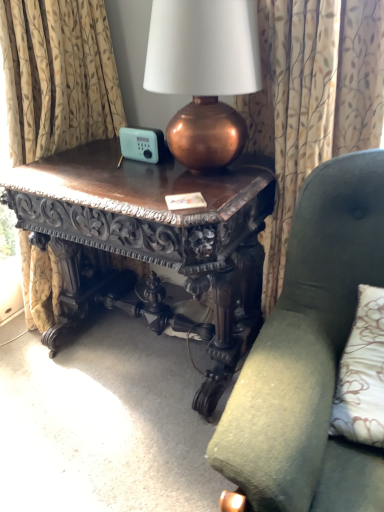
Describe the element at coordinates (313, 101) in the screenshot. I see `patterned fabric curtain at upper center` at that location.

Image resolution: width=384 pixels, height=512 pixels. Find the location of `patterned fabric curtain at upper center`. patterned fabric curtain at upper center is located at coordinates (313, 101).

I want to click on polished dark wood table at center, so [153, 241].

What do you see at coordinates (204, 74) in the screenshot? The image size is (384, 512). I see `copper metallic lamp at upper center` at bounding box center [204, 74].

At what (x,y) coordinates should I click in order to perform the action: click on patterned fabric curtain at upper center. Please return your answer as a coordinate pair (x, y). Looking at the image, I should click on (313, 101).

From a real-world perspective, who is located lower, patterned fabric curtain at upper center or green fabric chair at center?

green fabric chair at center.

From the image's perspective, between patterned fabric curtain at upper center and green fabric chair at center, which one is located above?

patterned fabric curtain at upper center is shown above in the image.

Does patterned fabric curtain at upper center appear on the right side of green fabric chair at center?

Indeed, patterned fabric curtain at upper center is positioned on the right side of green fabric chair at center.

Does patterned fabric curtain at upper center come behind green fabric chair at center?

Yes, it is.

In terms of height, does polished dark wood table at center look taller or shorter compared to green fabric chair at center?

polished dark wood table at center is shorter than green fabric chair at center.

From a real-world perspective, which object rests below the other?

polished dark wood table at center is physically lower.

Is point (223, 291) farther from viewer compared to point (351, 447)?

Yes, it is.

Is green fabric chair at center positioned with its back to patterned fabric curtain at upper center?

That's right, green fabric chair at center is facing away from patterned fabric curtain at upper center.

Considering the positions of points (324, 333) and (359, 58), is point (324, 333) closer to camera compared to point (359, 58)?

That is True.

From a real-world perspective, is green fabric chair at center physically above patterned fabric curtain at upper center?

No, from a real-world perspective, green fabric chair at center is not over patterned fabric curtain at upper center

Is green fabric chair at center positioned before patterned fabric curtain at upper center?

Yes, green fabric chair at center is closer to the viewer.

From a real-world perspective, is green fabric chair at center above or below copper metallic lamp at upper center?

green fabric chair at center is below copper metallic lamp at upper center.

Is green fabric chair at center far from copper metallic lamp at upper center?

green fabric chair at center is near copper metallic lamp at upper center, not far away.

Locate an element on the screen. This screenshot has height=512, width=384. chair in front of the copper metallic lamp at upper center is located at coordinates (310, 354).

Is polished dark wood table at center located outside patterned fabric curtain at upper center?

Yes, polished dark wood table at center is outside of patterned fabric curtain at upper center.

Who is bigger, polished dark wood table at center or patterned fabric curtain at upper center?

polished dark wood table at center.

Which is in front, point (267, 193) or point (257, 140)?

The point (267, 193) is in front.

Considering the sizes of objects patterned fabric curtain at upper center and polished dark wood table at center in the image provided, who is taller, patterned fabric curtain at upper center or polished dark wood table at center?

patterned fabric curtain at upper center is taller.

Which of these two, patterned fabric curtain at upper center or polished dark wood table at center, is thinner?

With smaller width is patterned fabric curtain at upper center.

Would you say patterned fabric curtain at upper center is outside polished dark wood table at center?

Absolutely, patterned fabric curtain at upper center is external to polished dark wood table at center.

Which is in front, point (375, 93) or point (239, 237)?

Positioned in front is point (375, 93).

In order to click on lamp that appears above the patterned fabric curtain at upper center (from a real-world perspective) in this screenshot , I will do `click(204, 74)`.

How many degrees apart are the facing directions of patterned fabric curtain at upper center and copper metallic lamp at upper center?

The facing directions of patterned fabric curtain at upper center and copper metallic lamp at upper center are 6.77 degrees apart.

Is patterned fabric curtain at upper center in front of copper metallic lamp at upper center?

No, it is not.

Is patterned fabric curtain at upper center next to copper metallic lamp at upper center and touching it?

They are not placed beside each other.

What are the coordinates of `curtain behind the green fabric chair at center` in the screenshot? It's located at (313, 101).

This screenshot has height=512, width=384. Identify the location of chair above the polished dark wood table at center (from a real-world perspective). (310, 354).

From the image, which object appears to be nearer to copper metallic lamp at upper center, green fabric chair at center or polished dark wood table at center?

polished dark wood table at center lies closer to copper metallic lamp at upper center than the other object.

Looking at the image, which one is located further to copper metallic lamp at upper center, polished dark wood table at center or green fabric chair at center?

green fabric chair at center is further to copper metallic lamp at upper center.

Consider the image. From the image, which object appears to be nearer to patterned fabric curtain at upper center, copper metallic lamp at upper center or polished dark wood table at center?

Based on the image, copper metallic lamp at upper center appears to be nearer to patterned fabric curtain at upper center.

Based on their spatial positions, is green fabric chair at center or polished dark wood table at center further from patterned fabric curtain at upper center?

Based on the image, green fabric chair at center appears to be further to patterned fabric curtain at upper center.

Based on their spatial positions, is copper metallic lamp at upper center or patterned fabric curtain at upper center further from polished dark wood table at center?

patterned fabric curtain at upper center is positioned further to the anchor polished dark wood table at center.

From the image, which object appears to be nearer to polished dark wood table at center, green fabric chair at center or copper metallic lamp at upper center?

copper metallic lamp at upper center lies closer to polished dark wood table at center than the other object.

Considering their positions, is green fabric chair at center positioned further to patterned fabric curtain at upper center than copper metallic lamp at upper center?

The object further to patterned fabric curtain at upper center is green fabric chair at center.

When comparing their distances from polished dark wood table at center, does green fabric chair at center or patterned fabric curtain at upper center seem further?

Among the two, green fabric chair at center is located further to polished dark wood table at center.

Where is `curtain that lies between copper metallic lamp at upper center and polished dark wood table at center from top to bottom`? curtain that lies between copper metallic lamp at upper center and polished dark wood table at center from top to bottom is located at coordinates (313, 101).

Where is `curtain between copper metallic lamp at upper center and green fabric chair at center from top to bottom`? curtain between copper metallic lamp at upper center and green fabric chair at center from top to bottom is located at coordinates (313, 101).

The width and height of the screenshot is (384, 512). I want to click on table between copper metallic lamp at upper center and green fabric chair at center in the up-down direction, so click(153, 241).

I want to click on curtain between green fabric chair at center and polished dark wood table at center from front to back, so click(x=313, y=101).